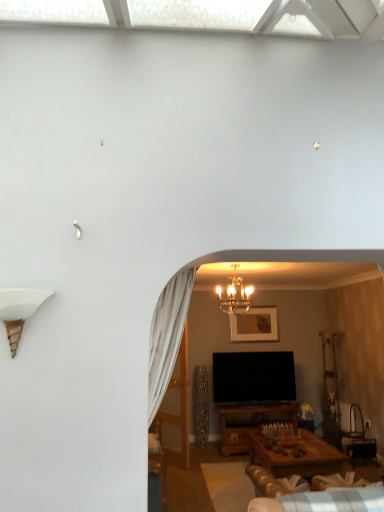
Find the location of a particular element. This screenshot has height=512, width=384. plush beige couch at lower center is located at coordinates (311, 498).

Could you tell me if gold metallic chandelier at center is facing gold-framed picture at upper center?

No, gold metallic chandelier at center is not oriented towards gold-framed picture at upper center.

Who is taller, gold metallic chandelier at center or gold-framed picture at upper center?

With more height is gold-framed picture at upper center.

Is point (233, 267) closer to viewer compared to point (265, 317)?

Yes, it is in front of point (265, 317).

Is gold metallic chandelier at center positioned far away from gold-framed picture at upper center?

Yes, gold metallic chandelier at center is far from gold-framed picture at upper center.

This screenshot has width=384, height=512. What are the coordinates of `glass door below the gold metallic chandelier at center (from the image's perspective)` in the screenshot? It's located at (179, 409).

Looking at the image, does translucent glass door at center seem bigger or smaller compared to gold metallic chandelier at center?

Considering their sizes, translucent glass door at center takes up more space than gold metallic chandelier at center.

Does translucent glass door at center have a lesser height compared to gold metallic chandelier at center?

In fact, translucent glass door at center may be taller than gold metallic chandelier at center.

Between point (184, 348) and point (275, 335), which one is positioned behind?

The point (275, 335) is farther from the camera.

Is translucent glass door at center looking in the opposite direction of gold-framed picture at upper center?

Yes, translucent glass door at center's orientation is away from gold-framed picture at upper center.

From the image's perspective, which one is positioned lower, translucent glass door at center or gold-framed picture at upper center?

From the image's view, translucent glass door at center is below.

Does translucent glass door at center come behind gold-framed picture at upper center?

No, it is in front of gold-framed picture at upper center.

From a real-world perspective, is gold-framed picture at upper center physically below gold metallic chandelier at center?

Indeed, from a real-world perspective, gold-framed picture at upper center is positioned beneath gold metallic chandelier at center.

Is gold-framed picture at upper center spatially inside gold metallic chandelier at center, or outside of it?

gold-framed picture at upper center is not inside gold metallic chandelier at center, it's outside.

Is gold-framed picture at upper center looking in the opposite direction of gold metallic chandelier at center?

That's not correct — gold-framed picture at upper center is not looking away from gold metallic chandelier at center.

From a real-world perspective, is plush beige couch at lower center physically below gold-framed picture at upper center?

Correct, in the physical world, plush beige couch at lower center is lower than gold-framed picture at upper center.

Is plush beige couch at lower center not close to gold-framed picture at upper center?

plush beige couch at lower center is positioned a significant distance from gold-framed picture at upper center.

In the scene shown: Can you confirm if plush beige couch at lower center is wider than gold-framed picture at upper center?

Correct, the width of plush beige couch at lower center exceeds that of gold-framed picture at upper center.

From the picture: Is plush beige couch at lower center closer to camera compared to gold-framed picture at upper center?

Yes, it is in front of gold-framed picture at upper center.

Between translucent glass door at center and plush beige couch at lower center, which one appears on the right side from the viewer's perspective?

Positioned to the right is plush beige couch at lower center.

Can you confirm if translucent glass door at center is smaller than plush beige couch at lower center?

Indeed, translucent glass door at center has a smaller size compared to plush beige couch at lower center.

Looking at their sizes, would you say translucent glass door at center is wider or thinner than plush beige couch at lower center?

Considering their sizes, translucent glass door at center looks slimmer than plush beige couch at lower center.

From a real-world perspective, which object stands above the other?

translucent glass door at center.

From a real-world perspective, which object stands above the other?

gold-framed picture at upper center.

Image resolution: width=384 pixels, height=512 pixels. I want to click on glass door directly beneath the gold-framed picture at upper center (from a real-world perspective), so click(179, 409).

Which is correct: gold-framed picture at upper center is inside translucent glass door at center, or outside of it?

gold-framed picture at upper center is not enclosed by translucent glass door at center.

Considering the sizes of objects gold-framed picture at upper center and translucent glass door at center in the image provided, who is shorter, gold-framed picture at upper center or translucent glass door at center?

gold-framed picture at upper center.

I want to click on picture frame on the right of gold metallic chandelier at center, so click(x=255, y=325).

The image size is (384, 512). I want to click on glass door on the left of gold metallic chandelier at center, so click(x=179, y=409).

Considering their positions, is gold-framed picture at upper center positioned closer to gold metallic chandelier at center than plush beige couch at lower center?

gold-framed picture at upper center is closer to gold metallic chandelier at center.

Looking at the image, which one is located further to translucent glass door at center, gold-framed picture at upper center or gold metallic chandelier at center?

gold metallic chandelier at center.

Based on their spatial positions, is translucent glass door at center or gold-framed picture at upper center further from gold metallic chandelier at center?

translucent glass door at center.

Estimate the real-world distances between objects in this image. Which object is further from gold metallic chandelier at center, plush beige couch at lower center or gold-framed picture at upper center?

The object further to gold metallic chandelier at center is plush beige couch at lower center.

Looking at the image, which one is located closer to gold-framed picture at upper center, translucent glass door at center or gold metallic chandelier at center?

Among the two, gold metallic chandelier at center is located nearer to gold-framed picture at upper center.

Based on their spatial positions, is gold metallic chandelier at center or plush beige couch at lower center further from translucent glass door at center?

Among the two, plush beige couch at lower center is located further to translucent glass door at center.

Based on their spatial positions, is gold-framed picture at upper center or plush beige couch at lower center closer to translucent glass door at center?

gold-framed picture at upper center is closer to translucent glass door at center.

Based on their spatial positions, is gold metallic chandelier at center or gold-framed picture at upper center further from plush beige couch at lower center?

Based on the image, gold-framed picture at upper center appears to be further to plush beige couch at lower center.

At what (x,y) coordinates should I click in order to perform the action: click on light fixture between plush beige couch at lower center and gold-framed picture at upper center from front to back. Please return your answer as a coordinate pair (x, y). The width and height of the screenshot is (384, 512). Looking at the image, I should click on (235, 295).

The height and width of the screenshot is (512, 384). What are the coordinates of `glass door located between gold metallic chandelier at center and gold-framed picture at upper center in the depth direction` in the screenshot? It's located at (179, 409).

This screenshot has height=512, width=384. Find the location of `light fixture located between plush beige couch at lower center and translucent glass door at center in the depth direction`. light fixture located between plush beige couch at lower center and translucent glass door at center in the depth direction is located at coordinates (235, 295).

Locate an element on the screen. glass door positioned between plush beige couch at lower center and gold-framed picture at upper center from near to far is located at coordinates (179, 409).